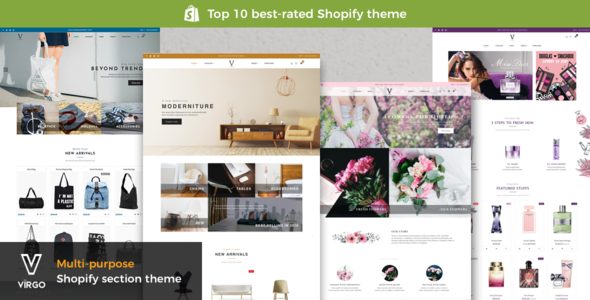
Locate an element on the screen. The width and height of the screenshot is (590, 300). perfume is located at coordinates (498, 277), (532, 282), (557, 279), (559, 231), (523, 221), (499, 225), (553, 156).